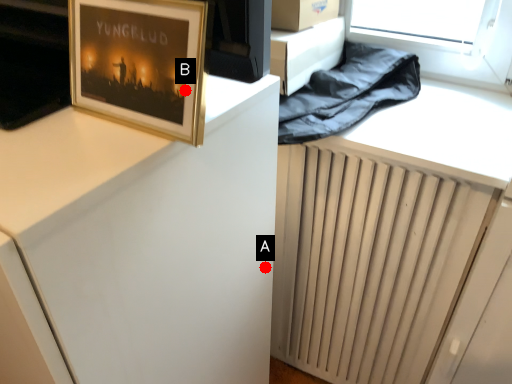
Question: Two points are circled on the image, labeled by A and B beside each circle. Which point appears closest to the camera in this image?

Choices:
 (A) A is closer
 (B) B is closer

Answer: (B)